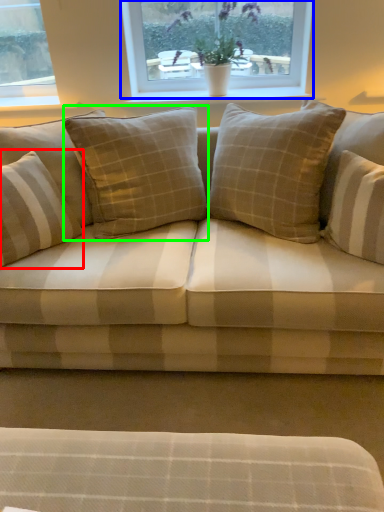
Question: Estimate the real-world distances between objects in this image. Which object is farther from pillow (highlighted by a red box), window (highlighted by a blue box) or pillow (highlighted by a green box)?

Choices:
 (A) window
 (B) pillow

Answer: (A)